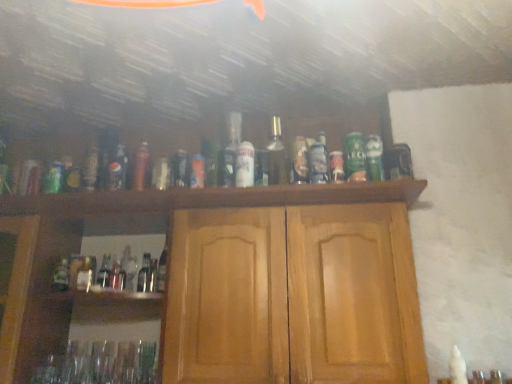
Locate an element on the screen. This screenshot has height=384, width=512. vacant area situated to the left side of green matte can at center, the first beer when ordered from right to left is located at coordinates (311, 190).